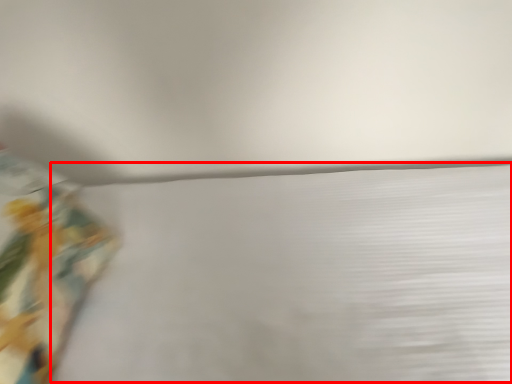
Question: Considering the relative positions of sheet (annotated by the red box) and curtain in the image provided, where is sheet (annotated by the red box) located with respect to the staircase?

Choices:
 (A) left
 (B) right

Answer: (B)